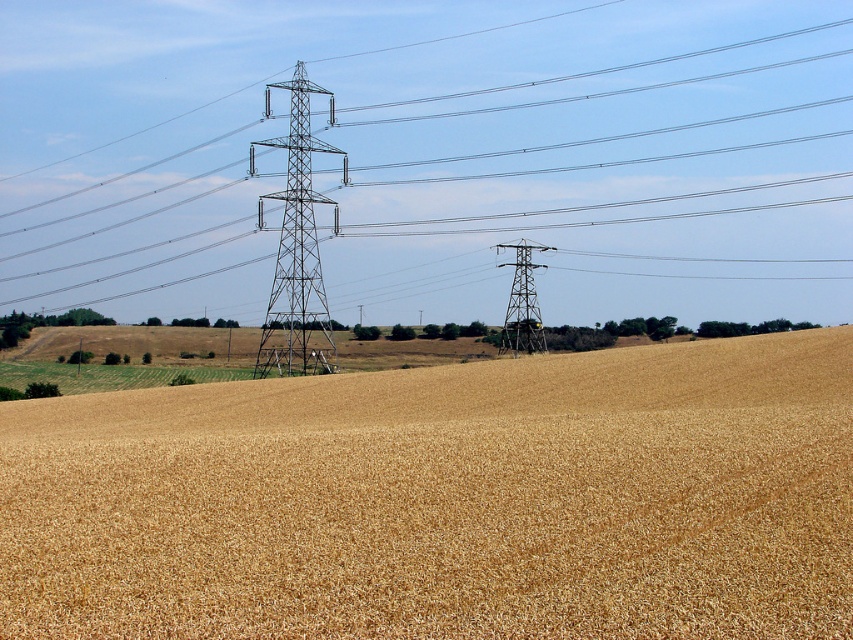
The height and width of the screenshot is (640, 853). Find the location of `metallic silver power line at upper center`. metallic silver power line at upper center is located at coordinates (431, 156).

Is metallic silver power line at upper center positioned in front of metallic gray tower at center?

No.

You are a GUI agent. You are given a task and a screenshot of the screen. Output one action in this format:
    pyautogui.click(x=<x>, y=<y>)
    Task: Click on the metallic silver power line at upper center
    
    Given the screenshot: What is the action you would take?
    pyautogui.click(x=431, y=156)

Where is `metallic silver power line at upper center`? Image resolution: width=853 pixels, height=640 pixels. metallic silver power line at upper center is located at coordinates (431, 156).

Between metallic silver tower at center and metallic gray tower at center, which one is positioned higher?

metallic silver tower at center is above.

Is metallic silver tower at center below metallic gray tower at center?

No, metallic silver tower at center is not below metallic gray tower at center.

This screenshot has height=640, width=853. What are the coordinates of `metallic silver tower at center` in the screenshot? It's located at (297, 248).

Is metallic silver power line at upper center bigger than golden matte wheat field at center?

Correct, metallic silver power line at upper center is larger in size than golden matte wheat field at center.

Does metallic silver power line at upper center lie in front of golden matte wheat field at center?

That is False.

Is point (730, 115) positioned behind point (776, 584)?

That is True.

This screenshot has width=853, height=640. I want to click on metallic silver power line at upper center, so click(431, 156).